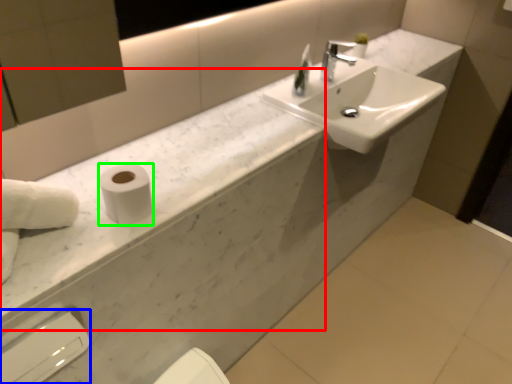
Question: Which object is positioned closest to counter top (highlighted by a red box)? Select from hand dryer (highlighted by a blue box) and toilet paper (highlighted by a green box).

Choices:
 (A) hand dryer
 (B) toilet paper

Answer: (B)